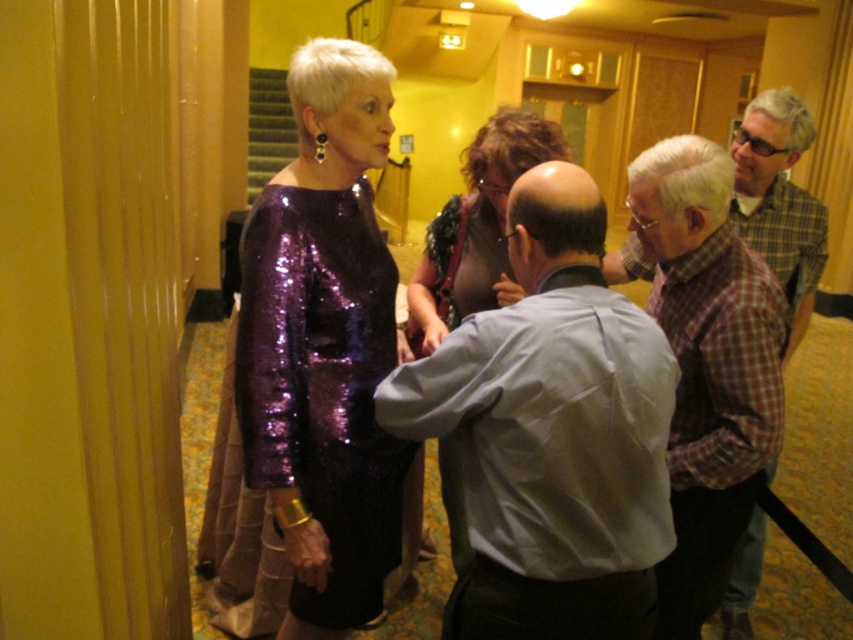
Question: Estimate the real-world distances between objects in this image. Which object is farther from the sparkly purple dress at center?

Choices:
 (A) light gray shirt at center
 (B) plaid shirt at right
 (C) plaid cotton shirt at center
 (D) shiny purple dress at center

Answer: (B)

Question: Which object is positioned farthest from the plaid shirt at right?

Choices:
 (A) plaid cotton shirt at center
 (B) sparkly purple dress at center

Answer: (B)

Question: Where is light gray shirt at center located in relation to plaid shirt at right in the image?

Choices:
 (A) above
 (B) below

Answer: (B)

Question: Is plaid cotton shirt at center positioned in front of shiny purple dress at center?

Choices:
 (A) no
 (B) yes

Answer: (B)

Question: Does light gray shirt at center appear on the right side of plaid cotton shirt at center?

Choices:
 (A) yes
 (B) no

Answer: (B)

Question: Estimate the real-world distances between objects in this image. Which object is farther from the light gray shirt at center?

Choices:
 (A) sparkly purple dress at center
 (B) plaid shirt at right
 (C) plaid cotton shirt at center

Answer: (B)